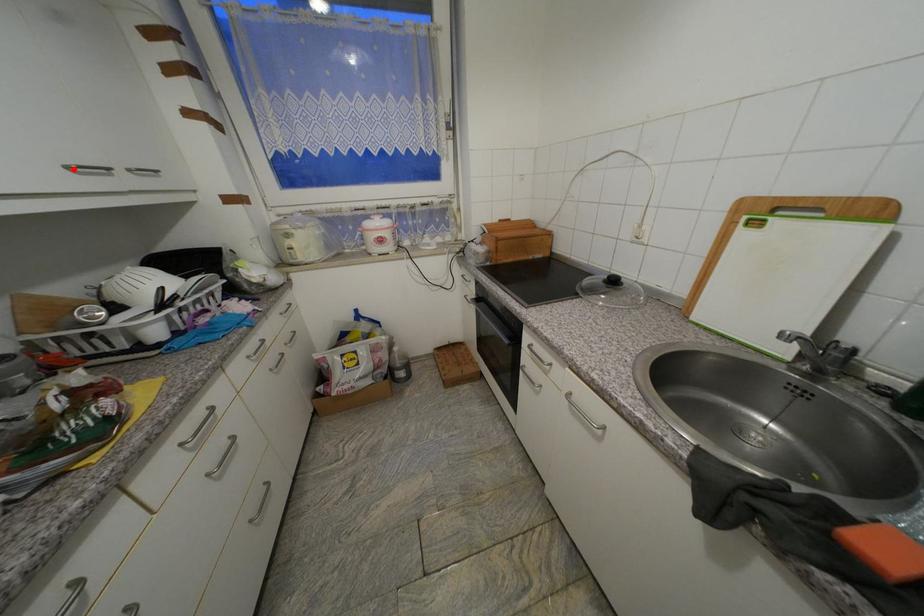
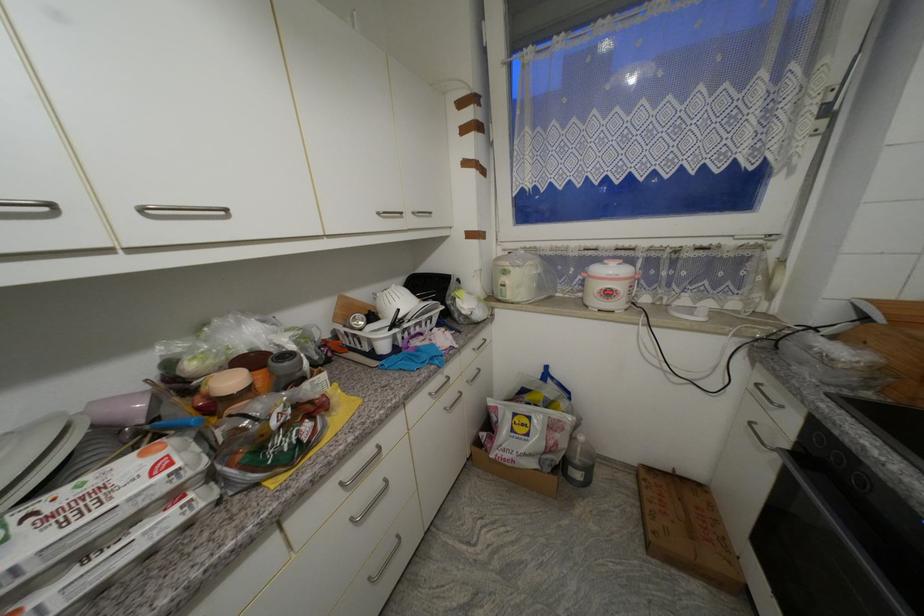
Locate, in the second image, the point that corresponds to the highlighted location in the first image.

(383, 215)